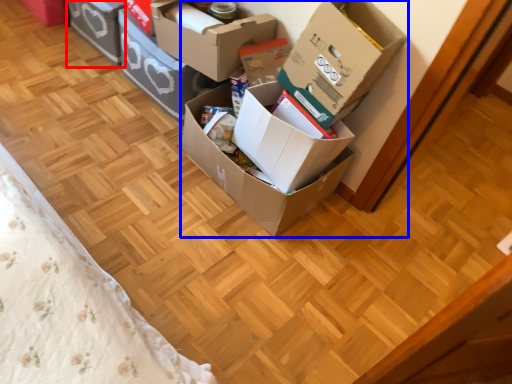
Question: Which object is closer to the camera taking this photo, box (highlighted by a red box) or box (highlighted by a blue box)?

Choices:
 (A) box
 (B) box

Answer: (B)